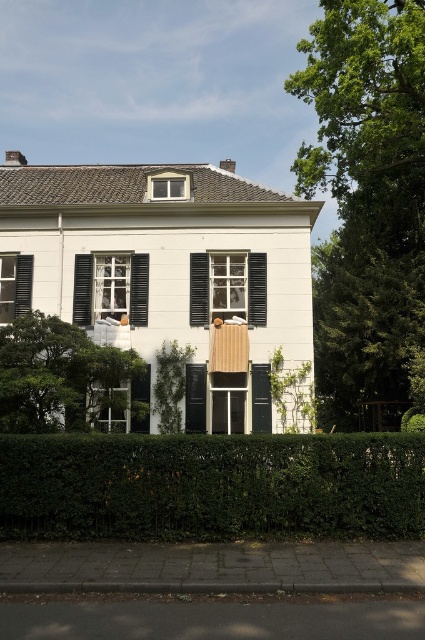
You are a delivery person approaching the entrance of the two story residential building. You need to deliver a package to the front door. As you approach, you notice the white wooden window at center and the black matte door at center. Which object should you look for to ensure you are at the correct entrance?

You should look for the black matte door at center because the white wooden window at center is to the right of it, indicating the door is the central entrance.